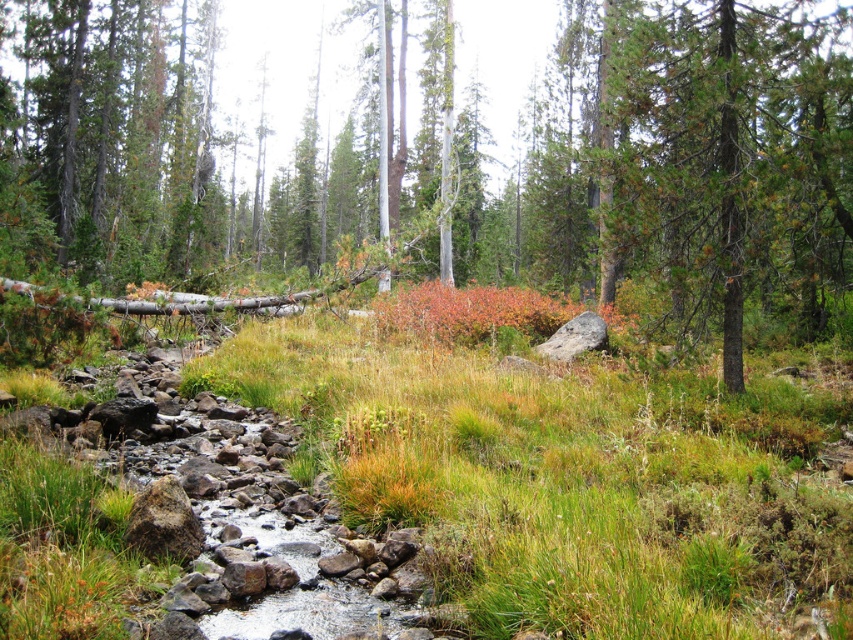
Does green grass at center come behind green needle-like at center?

No, it is not.

Find the location of a particular element. The width and height of the screenshot is (853, 640). green grass at center is located at coordinates (566, 481).

Is green matte tree at center further to the viewer compared to green grass at center?

Yes, green matte tree at center is further from the viewer.

In the scene shown: Who is more forward, (585,172) or (344,467)?

Point (344,467) is in front.

What do you see at coordinates (645, 164) in the screenshot? I see `green matte tree at center` at bounding box center [645, 164].

Image resolution: width=853 pixels, height=640 pixels. I want to click on green matte tree at center, so click(x=645, y=164).

Does point (196, 48) come in front of point (646, 29)?

No, (196, 48) is further to viewer.

At what (x,y) coordinates should I click in order to perform the action: click on green matte tree at center. Please return your answer as a coordinate pair (x, y). The height and width of the screenshot is (640, 853). Looking at the image, I should click on (645, 164).

This screenshot has width=853, height=640. Identify the location of green matte tree at center. (645, 164).

In order to click on green matte tree at center in this screenshot , I will do `click(645, 164)`.